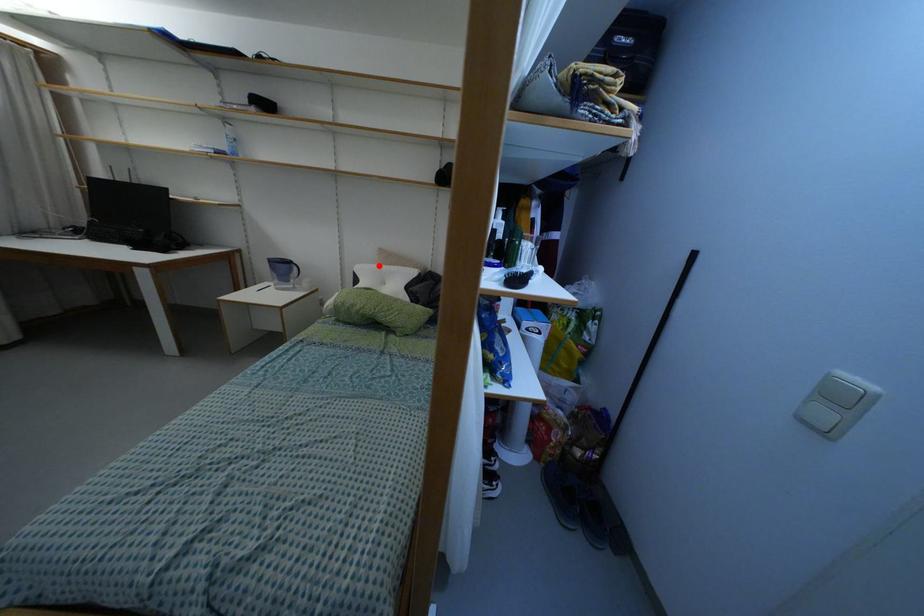
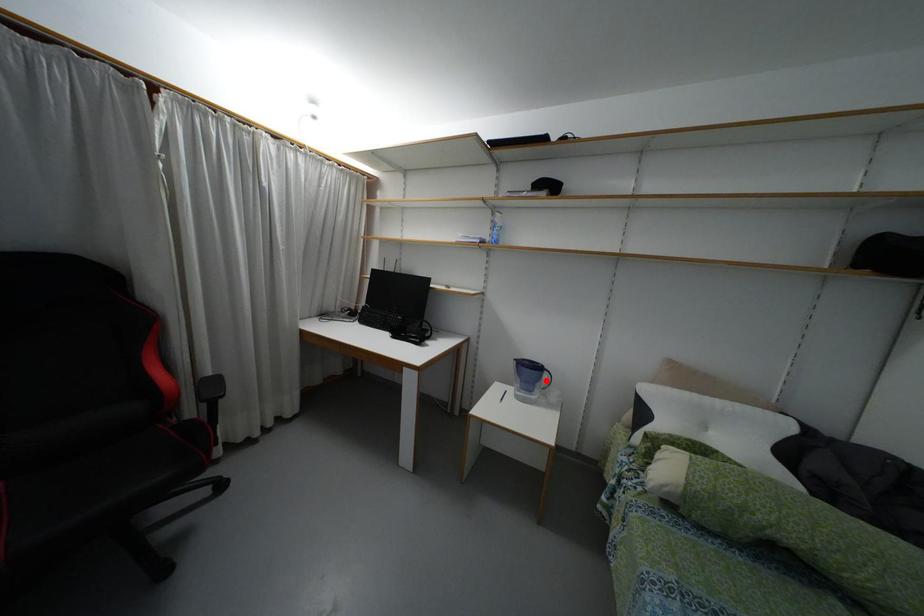
I am providing you with two images of the same scene from different viewpoints. A red point is marked on the first image and another point is marked on the second image. Is the marked point in image1 the same physical position as the marked point in image2?

→ No